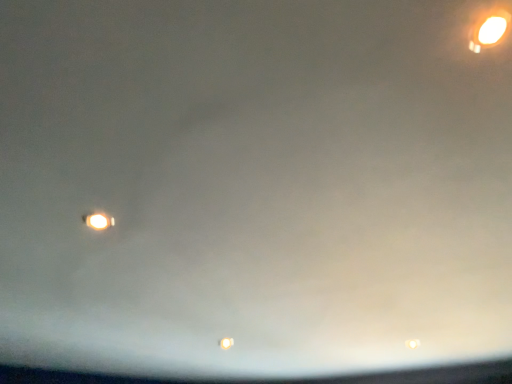
Question: Is matte yellow street light at upper right, the 2th street light in the back-to-front sequence, wider than matte yellow street light at lower left, which is counted as the 1th street light, starting from the left?

Choices:
 (A) no
 (B) yes

Answer: (A)

Question: Does matte yellow street light at upper right, the second street light from the bottom, have a larger size compared to matte yellow street light at lower left, which is the 2th street light in top-to-bottom order?

Choices:
 (A) no
 (B) yes

Answer: (B)

Question: Is the surface of matte yellow street light at upper right, the 2th street light in the back-to-front sequence, in direct contact with matte yellow street light at lower left, the first street light positioned from the back?

Choices:
 (A) yes
 (B) no

Answer: (B)

Question: From a real-world perspective, is matte yellow street light at upper right, the second street light from the bottom, physically above matte yellow street light at lower left, acting as the 2th street light starting from the front?

Choices:
 (A) no
 (B) yes

Answer: (B)

Question: Considering the relative sizes of matte yellow street light at upper right, which is the 2th street light in left-to-right order, and matte yellow street light at lower left, the first street light positioned from the back, in the image provided, is matte yellow street light at upper right, which is the 2th street light in left-to-right order, smaller than matte yellow street light at lower left, the first street light positioned from the back,?

Choices:
 (A) yes
 (B) no

Answer: (B)

Question: Is matte yellow street light at upper right, the second street light from the bottom, closer to the viewer compared to matte yellow street light at lower left, the first street light positioned from the back?

Choices:
 (A) yes
 (B) no

Answer: (A)

Question: Is matte yellow street light at lower left, placed as the first street light when sorted from bottom to top, shorter than matte yellow street light at upper right, the 2th street light in the back-to-front sequence?

Choices:
 (A) yes
 (B) no

Answer: (A)

Question: From the image's perspective, does matte yellow street light at lower left, the first street light positioned from the back, appear lower than matte yellow street light at upper right, the 1th street light viewed from the right?

Choices:
 (A) yes
 (B) no

Answer: (A)

Question: Is matte yellow street light at lower left, acting as the 2th street light starting from the front, at the right side of matte yellow street light at upper right, which is the 1th street light in front-to-back order?

Choices:
 (A) no
 (B) yes

Answer: (A)

Question: Does matte yellow street light at lower left, acting as the 2th street light starting from the front, have a lesser width compared to matte yellow street light at upper right, which is the 2th street light in left-to-right order?

Choices:
 (A) no
 (B) yes

Answer: (A)

Question: Is matte yellow street light at lower left, which is counted as the 1th street light, starting from the left, oriented towards matte yellow street light at upper right, the 2th street light in the back-to-front sequence?

Choices:
 (A) no
 (B) yes

Answer: (A)

Question: Can you confirm if matte yellow street light at lower left, acting as the 2th street light starting from the front, is smaller than matte yellow street light at upper right, which is the 1th street light in top-to-bottom order?

Choices:
 (A) yes
 (B) no

Answer: (A)

Question: From their relative heights in the image, would you say matte yellow street light at lower left, the first street light positioned from the back, is taller or shorter than matte yellow street light at upper right, the 2th street light in the back-to-front sequence?

Choices:
 (A) tall
 (B) short

Answer: (B)